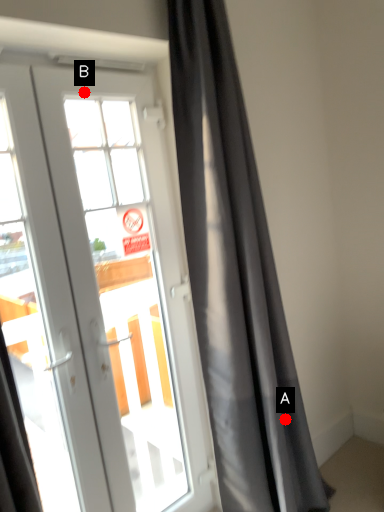
Question: Two points are circled on the image, labeled by A and B beside each circle. Which point is farther to the camera?

Choices:
 (A) A is further
 (B) B is further

Answer: (A)